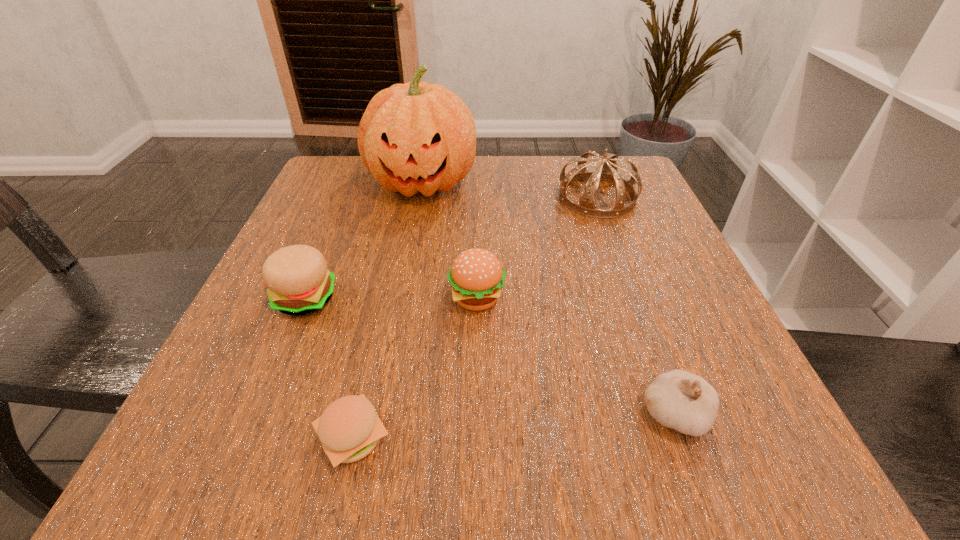
This screenshot has width=960, height=540. In the image, there is a desktop. Find the location of `free region at the near right corner`. free region at the near right corner is located at coordinates (715, 444).

Where is `vacant space in between the leftmost hamburger and the rightmost hamburger`? This screenshot has height=540, width=960. vacant space in between the leftmost hamburger and the rightmost hamburger is located at coordinates (391, 299).

At what (x,y) coordinates should I click in order to perform the action: click on free space between the pumpkin and the second tallest object. Please return your answer as a coordinate pair (x, y). This screenshot has width=960, height=540. Looking at the image, I should click on (510, 190).

The height and width of the screenshot is (540, 960). I want to click on free spot between the leftmost hamburger and the tiara, so [x=451, y=248].

You are a GUI agent. You are given a task and a screenshot of the screen. Output one action in this format:
    pyautogui.click(x=<x>, y=<y>)
    Task: Click on the vacant area that lies between the garlic and the leftmost hamburger
    The height and width of the screenshot is (540, 960).
    Given the screenshot: What is the action you would take?
    pyautogui.click(x=490, y=356)

Identify the location of free space between the pumpkin and the garlic. (549, 299).

Image resolution: width=960 pixels, height=540 pixels. Identify the location of unoccupied area between the garlic and the nearest hamburger. (514, 426).

Locate an element on the screen. Image resolution: width=960 pixels, height=540 pixels. vacant space that is in between the leftmost hamburger and the rightmost hamburger is located at coordinates pos(391,299).

This screenshot has height=540, width=960. I want to click on free space between the tallest object and the fifth shortest object, so click(x=510, y=190).

Identify the location of vacant space that is in between the pumpkin and the nearest hamburger. (388, 310).